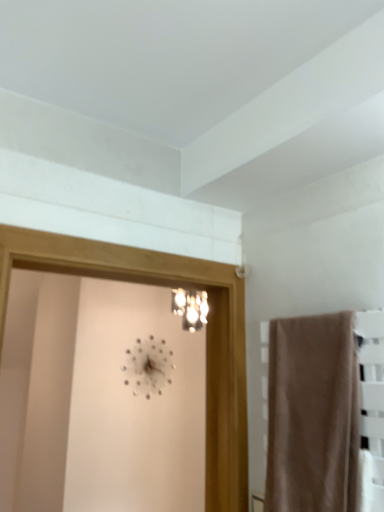
Question: Is clear glass screen door at center placed right next to metallic silver clock at upper center?

Choices:
 (A) no
 (B) yes

Answer: (A)

Question: From a real-world perspective, is clear glass screen door at center under metallic silver clock at upper center?

Choices:
 (A) no
 (B) yes

Answer: (B)

Question: Could metallic silver clock at upper center be considered to be inside clear glass screen door at center?

Choices:
 (A) no
 (B) yes

Answer: (A)

Question: Can you confirm if clear glass screen door at center is wider than metallic silver clock at upper center?

Choices:
 (A) no
 (B) yes

Answer: (B)

Question: Does clear glass screen door at center have a greater height compared to metallic silver clock at upper center?

Choices:
 (A) no
 (B) yes

Answer: (B)

Question: From a real-world perspective, is metallic silver clock at upper center above or below clear glass screen door at center?

Choices:
 (A) above
 (B) below

Answer: (A)

Question: Is metallic silver clock at upper center wider or thinner than clear glass screen door at center?

Choices:
 (A) thin
 (B) wide

Answer: (A)

Question: From the image's perspective, is metallic silver clock at upper center above or below clear glass screen door at center?

Choices:
 (A) below
 (B) above

Answer: (A)

Question: Would you say metallic silver clock at upper center is to the left or to the right of clear glass screen door at center in the picture?

Choices:
 (A) left
 (B) right

Answer: (A)

Question: Looking at their shapes, would you say beige fabric towel at right is wider or thinner than metallic silver clock at upper center?

Choices:
 (A) wide
 (B) thin

Answer: (A)

Question: In the image, is beige fabric towel at right positioned in front of or behind metallic silver clock at upper center?

Choices:
 (A) front
 (B) behind

Answer: (A)

Question: From the image's perspective, is beige fabric towel at right positioned above or below metallic silver clock at upper center?

Choices:
 (A) below
 (B) above

Answer: (B)

Question: Does point (276, 428) appear closer or farther from the camera than point (170, 378)?

Choices:
 (A) closer
 (B) farther

Answer: (A)

Question: In terms of height, does metallic silver clock at upper center look taller or shorter compared to beige fabric towel at right?

Choices:
 (A) tall
 (B) short

Answer: (B)

Question: Looking at their shapes, would you say metallic silver clock at upper center is wider or thinner than beige fabric towel at right?

Choices:
 (A) wide
 (B) thin

Answer: (B)